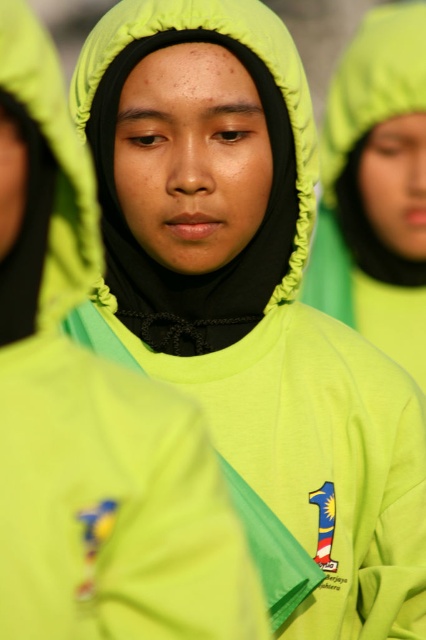
Does point (362, 252) come farther from viewer compared to point (256, 26)?

Yes.

Does matte green hoodie at center appear on the left side of matte green hood at center?

In fact, matte green hoodie at center is to the right of matte green hood at center.

Is point (400, 20) farther from camera compared to point (232, 28)?

Yes.

The width and height of the screenshot is (426, 640). I want to click on matte green hoodie at center, so click(x=376, y=188).

Which is more to the right, lime green fabric hood at left or matte green hood at center?

matte green hood at center is more to the right.

Does point (43, 58) come farther from viewer compared to point (244, 28)?

No, it is not.

What are the coordinates of `lime green fabric hood at left` in the screenshot? It's located at (45, 186).

Is neon green fabric jacket at center positioned behind matte green hood at center?

No.

Between neon green fabric jacket at center and matte green hood at center, which one has more height?

neon green fabric jacket at center

Locate an element on the screen. Image resolution: width=426 pixels, height=640 pixels. neon green fabric jacket at center is located at coordinates (100, 444).